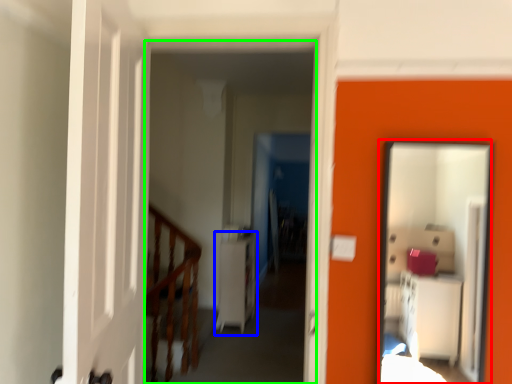
Question: Which object is the farthest from mirror (highlighted by a red box)? Choose among these: dresser (highlighted by a blue box) or corridor (highlighted by a green box).

Choices:
 (A) dresser
 (B) corridor

Answer: (B)